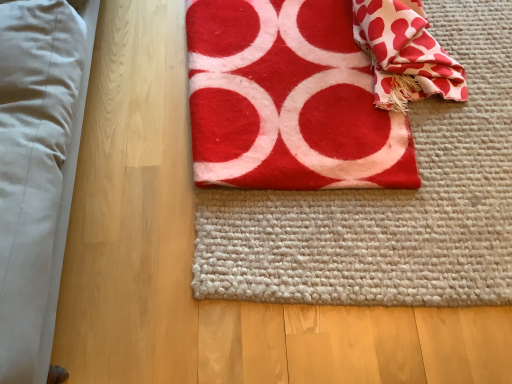
Locate an element on the screen. The height and width of the screenshot is (384, 512). free area in between white textured fabric at upper right and red felt towel at center is located at coordinates (438, 141).